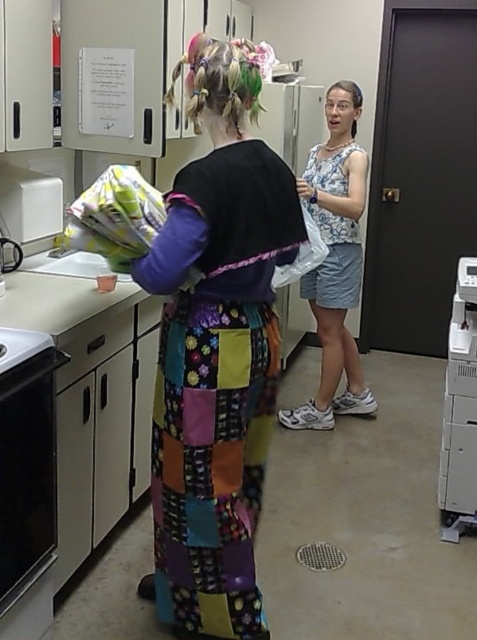
Question: Which is farther from the patchwork apron at center?

Choices:
 (A) black glass oven at lower left
 (B) white plastic printer at right
 (C) floral fabric dress at center

Answer: (C)

Question: Can you confirm if patchwork apron at center is positioned above black glass oven at lower left?

Choices:
 (A) no
 (B) yes

Answer: (B)

Question: Is black glass oven at lower left below floral fabric dress at center?

Choices:
 (A) yes
 (B) no

Answer: (A)

Question: Is patchwork apron at center thinner than white plastic printer at right?

Choices:
 (A) no
 (B) yes

Answer: (A)

Question: Estimate the real-world distances between objects in this image. Which object is closer to the white plastic printer at right?

Choices:
 (A) floral fabric dress at center
 (B) black glass oven at lower left

Answer: (A)

Question: Which of the following is the farthest from the observer?

Choices:
 (A) (18, 444)
 (B) (225, 426)
 (C) (456, 376)
 (D) (345, 164)

Answer: (D)